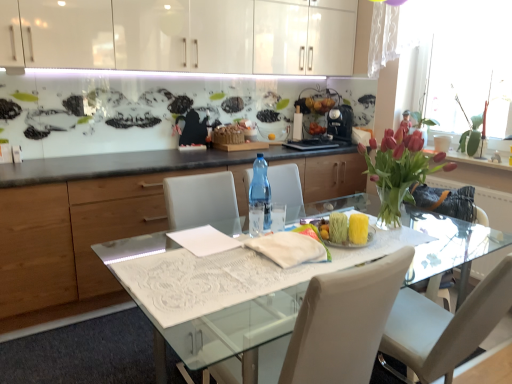
Question: From the image's perspective, relative to white leather chair at center, is pink glass vase at right above or below?

Choices:
 (A) above
 (B) below

Answer: (A)

Question: Is point (404, 198) positioned closer to the camera than point (276, 352)?

Choices:
 (A) closer
 (B) farther

Answer: (B)

Question: Estimate the real-world distances between objects in this image. Which object is closer to the white leather chair at center?

Choices:
 (A) transparent glass cup at center
 (B) wooden cabinet at left
 (C) pink glass vase at right
 (D) translucent glass vase at upper right
 (E) transparent glass table at center

Answer: (A)

Question: Based on their relative distances, which object is nearer to the translucent glass vase at upper right?

Choices:
 (A) white fabric at center
 (B) transparent plastic bottle at center
 (C) white leather chair at center
 (D) transparent glass table at center
 (E) transparent glass cup at center

Answer: (D)